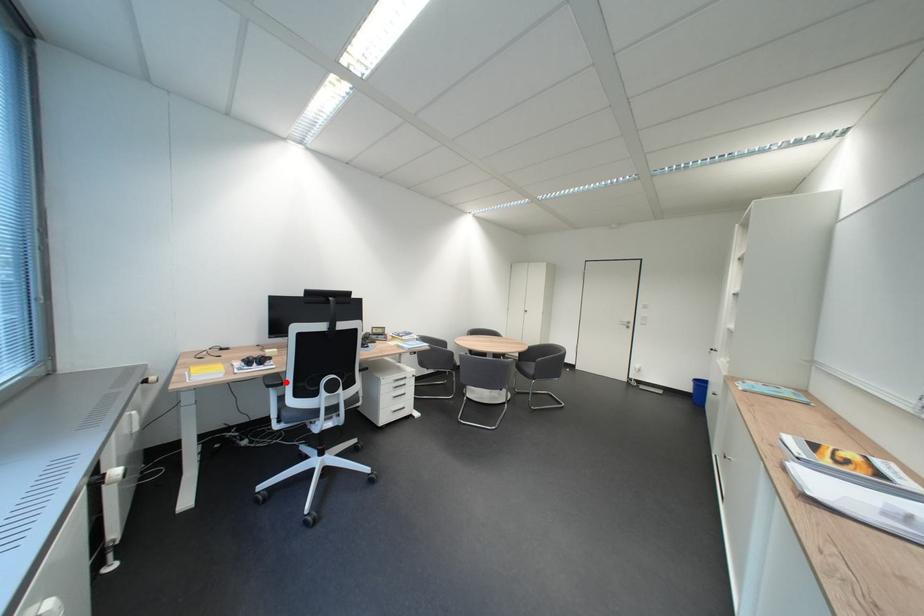
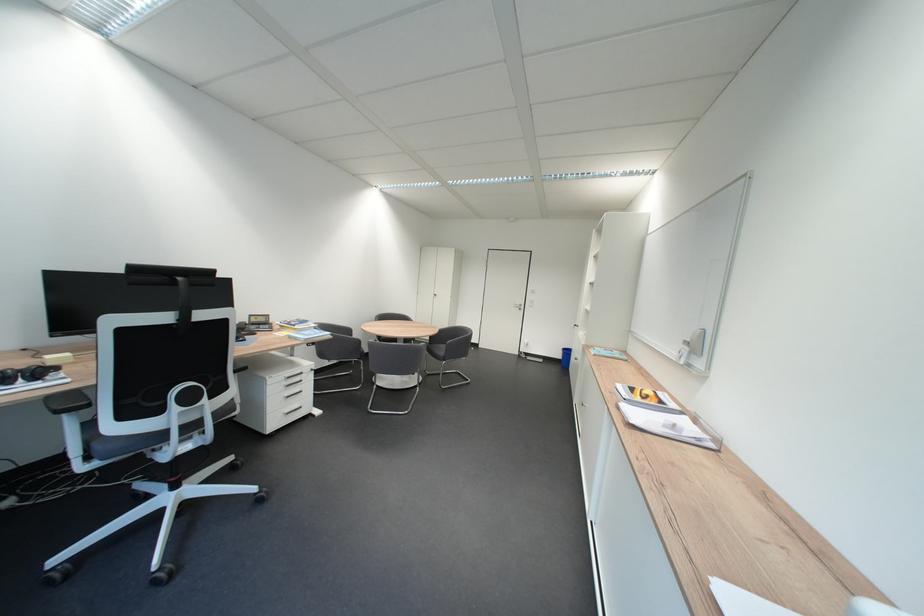
Locate, in the second image, the point that corresponds to the highlighted location in the first image.

(82, 403)